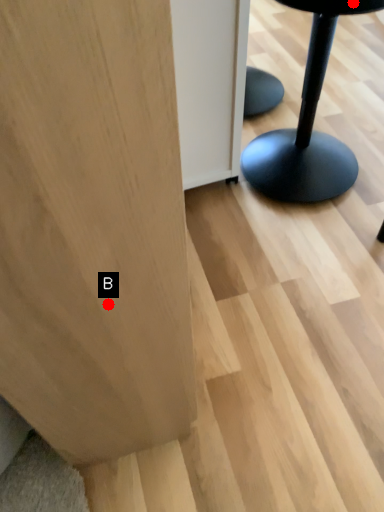
Question: Two points are circled on the image, labeled by A and B beside each circle. Which point is farther from the camera taking this photo?

Choices:
 (A) A is further
 (B) B is further

Answer: (A)